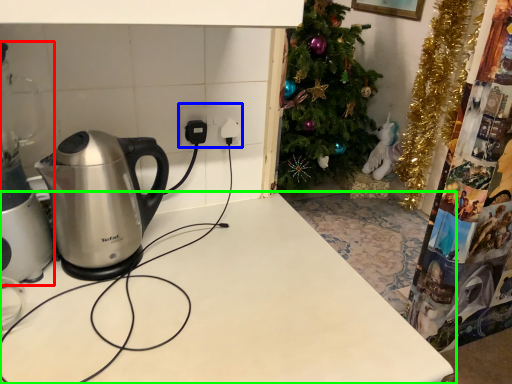
Question: Estimate the real-world distances between objects in this image. Which object is closer to appliance (highlighted by a red box), electric outlet (highlighted by a blue box) or table (highlighted by a green box)?

Choices:
 (A) electric outlet
 (B) table

Answer: (B)